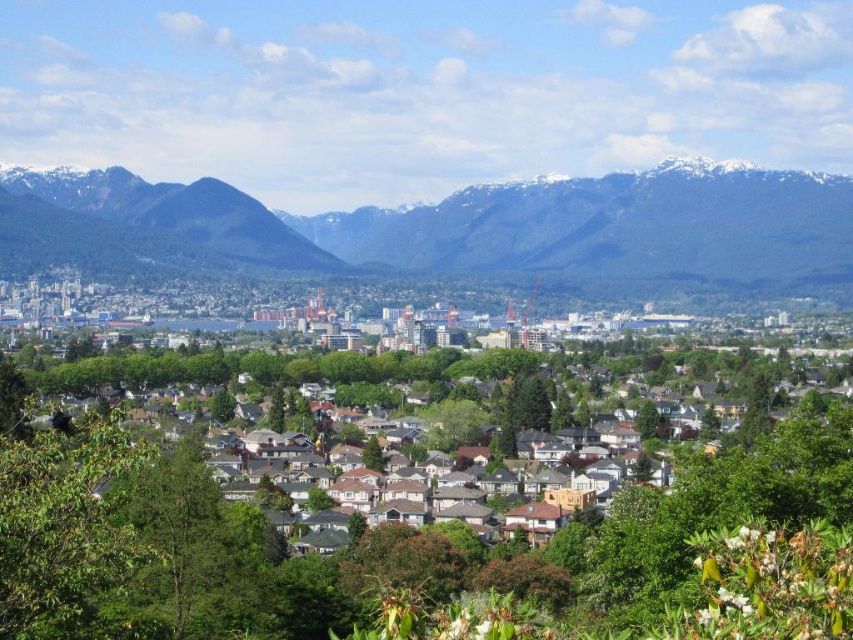
You are an urban planner analyzing the city layout. You need to determine which object occupies more horizontal space in the image between the green textured mountains at center and the white shingles at center. Based on the scene, which one is wider?

The green textured mountains at center is wider than the white shingles at center because the green textured mountains at center has a greater width as stated in the description.

You are standing in the city scene and want to take a photo that includes both the point at coordinates point (726, 275) and point (680, 563). Which point will appear closer to the front of the photo?

Point (726, 275) is further to the camera than point (680, 563), so in the photo, point (726, 275) will appear closer to the front of the photo.